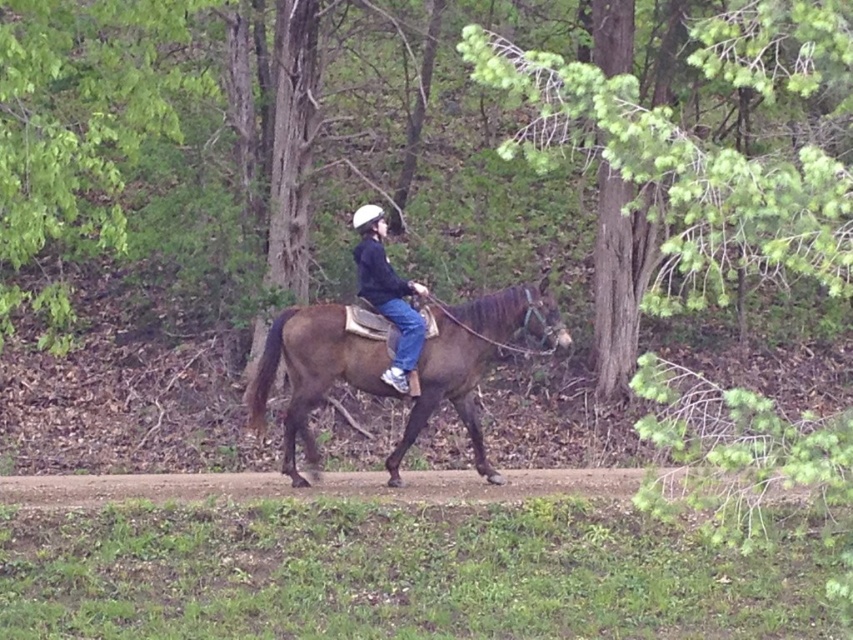
Question: Does green needle-like leaves at upper center have a greater width compared to black matte jacket at center?

Choices:
 (A) yes
 (B) no

Answer: (A)

Question: Which object is the farthest from the green leafy tree at center?

Choices:
 (A) green needle-like leaves at upper center
 (B) brown dirt track at center
 (C) black matte jacket at center

Answer: (B)

Question: Does brown leather horse at center appear under black matte jacket at center?

Choices:
 (A) yes
 (B) no

Answer: (A)

Question: Does green needle-like leaves at upper center have a larger size compared to brown leather horse at center?

Choices:
 (A) no
 (B) yes

Answer: (B)

Question: Which point is farther from the camera taking this photo?

Choices:
 (A) (819, 224)
 (B) (641, 145)
 (C) (366, 208)
 (D) (375, 474)

Answer: (D)

Question: Which of these objects is positioned farthest from the brown dirt track at center?

Choices:
 (A) black matte jacket at center
 (B) green needle-like leaves at upper center
 (C) brown leather horse at center
 (D) green leafy tree at center

Answer: (B)